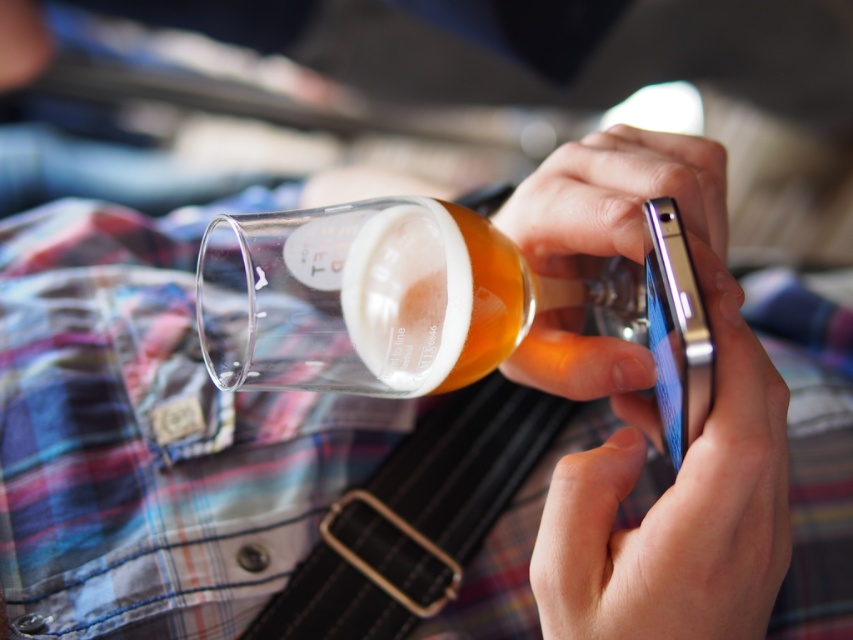
Question: Among these objects, which one is nearest to the camera?

Choices:
 (A) metallic silver phone at center
 (B) transparent glass at center

Answer: (A)

Question: Which object is farther from the camera taking this photo?

Choices:
 (A) transparent glass at center
 (B) metallic silver phone at center

Answer: (A)

Question: Can you confirm if metallic silver phone at center is wider than transparent glass at center?

Choices:
 (A) no
 (B) yes

Answer: (A)

Question: Is metallic silver phone at center wider than transparent glass at center?

Choices:
 (A) no
 (B) yes

Answer: (A)

Question: Is metallic silver phone at center above transparent glass at center?

Choices:
 (A) yes
 (B) no

Answer: (B)